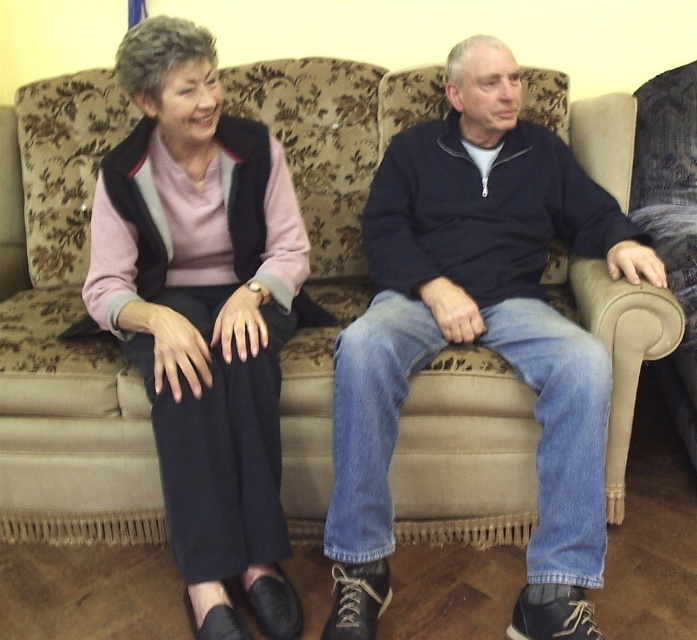
Question: Which point is farther from the camera taking this photo?

Choices:
 (A) (144, 161)
 (B) (470, 321)

Answer: (A)

Question: Which point is closer to the camera taking this photo?

Choices:
 (A) (114, 193)
 (B) (473, 221)

Answer: (A)

Question: Can you confirm if denim jeans at center is bigger than matte black pants at left?

Choices:
 (A) yes
 (B) no

Answer: (A)

Question: Where is denim jeans at center located in relation to matte black pants at left in the image?

Choices:
 (A) right
 (B) left

Answer: (A)

Question: Which point appears closest to the camera in this image?

Choices:
 (A) (645, 268)
 (B) (291, 259)

Answer: (A)

Question: Is denim jeans at center below matte black pants at left?

Choices:
 (A) yes
 (B) no

Answer: (B)